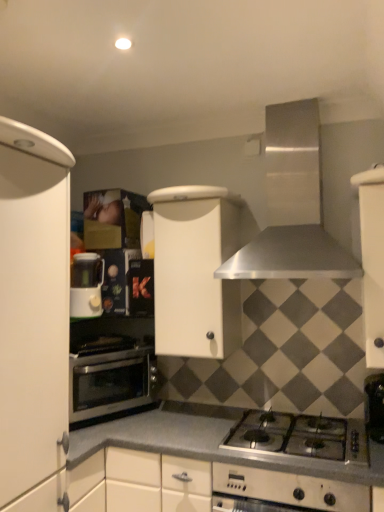
Question: Can you confirm if stainless steel oven at lower left is smaller than white matte cabinet at center, placed as the 2th cabinetry when sorted from left to right?

Choices:
 (A) no
 (B) yes

Answer: (B)

Question: Considering the relative positions of stainless steel oven at lower left and white matte cabinet at center, the second cabinetry when ordered from right to left, in the image provided, is stainless steel oven at lower left to the left of white matte cabinet at center, the second cabinetry when ordered from right to left, from the viewer's perspective?

Choices:
 (A) yes
 (B) no

Answer: (A)

Question: Is stainless steel oven at lower left at the right side of white matte cabinet at center, placed as the 2th cabinetry when sorted from left to right?

Choices:
 (A) no
 (B) yes

Answer: (A)

Question: From the image's perspective, is stainless steel oven at lower left on top of white matte cabinet at center, placed as the 2th cabinetry when sorted from left to right?

Choices:
 (A) yes
 (B) no

Answer: (B)

Question: Is stainless steel oven at lower left thinner than white matte cabinet at center, the second cabinetry when ordered from right to left?

Choices:
 (A) no
 (B) yes

Answer: (B)

Question: Considering the relative positions of silver metallic gas stove at lower center and white matte cabinet at left, marked as the 1th cabinetry in a left-to-right arrangement, in the image provided, is silver metallic gas stove at lower center to the left or to the right of white matte cabinet at left, marked as the 1th cabinetry in a left-to-right arrangement,?

Choices:
 (A) left
 (B) right

Answer: (B)

Question: In the image, is silver metallic gas stove at lower center positioned in front of or behind white matte cabinet at left, the 3th cabinetry when ordered from right to left?

Choices:
 (A) front
 (B) behind

Answer: (B)

Question: From the image's perspective, is silver metallic gas stove at lower center located above or below white matte cabinet at left, the 3th cabinetry when ordered from right to left?

Choices:
 (A) above
 (B) below

Answer: (B)

Question: Looking at the image, does silver metallic gas stove at lower center seem bigger or smaller compared to white matte cabinet at left, marked as the 1th cabinetry in a left-to-right arrangement?

Choices:
 (A) small
 (B) big

Answer: (A)

Question: From the image's perspective, is stainless steel range hood at upper center above or below stainless steel oven at lower left?

Choices:
 (A) above
 (B) below

Answer: (A)

Question: Based on their sizes in the image, would you say stainless steel range hood at upper center is bigger or smaller than stainless steel oven at lower left?

Choices:
 (A) big
 (B) small

Answer: (A)

Question: Is point (278, 163) positioned closer to the camera than point (99, 393)?

Choices:
 (A) farther
 (B) closer

Answer: (A)

Question: From a real-world perspective, is stainless steel range hood at upper center positioned above or below stainless steel oven at lower left?

Choices:
 (A) below
 (B) above

Answer: (B)

Question: Does point (369, 466) appear closer or farther from the camera than point (81, 304)?

Choices:
 (A) farther
 (B) closer

Answer: (B)

Question: Considering the positions of smooth gray countertop at center and white plastic coffee machine at left in the image, is smooth gray countertop at center wider or thinner than white plastic coffee machine at left?

Choices:
 (A) thin
 (B) wide

Answer: (B)